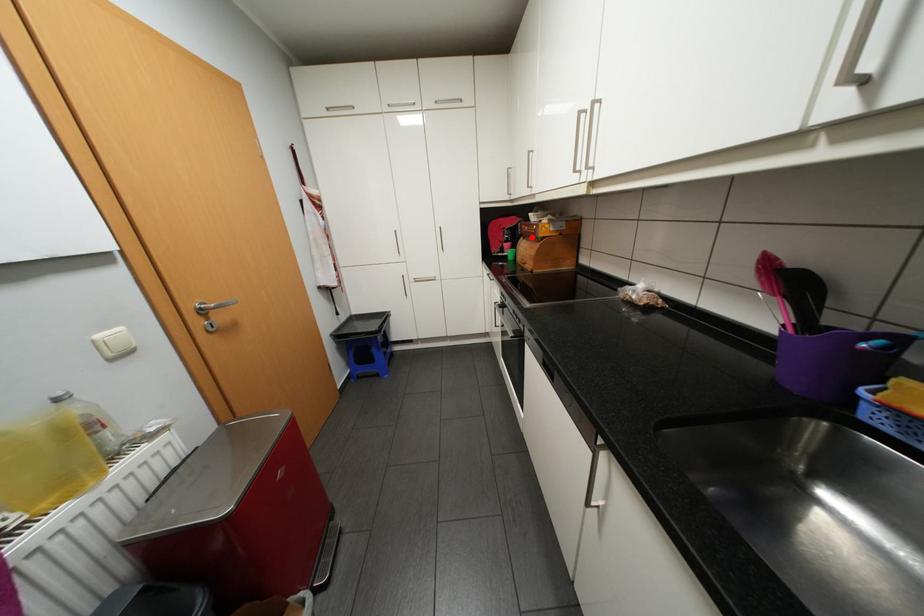
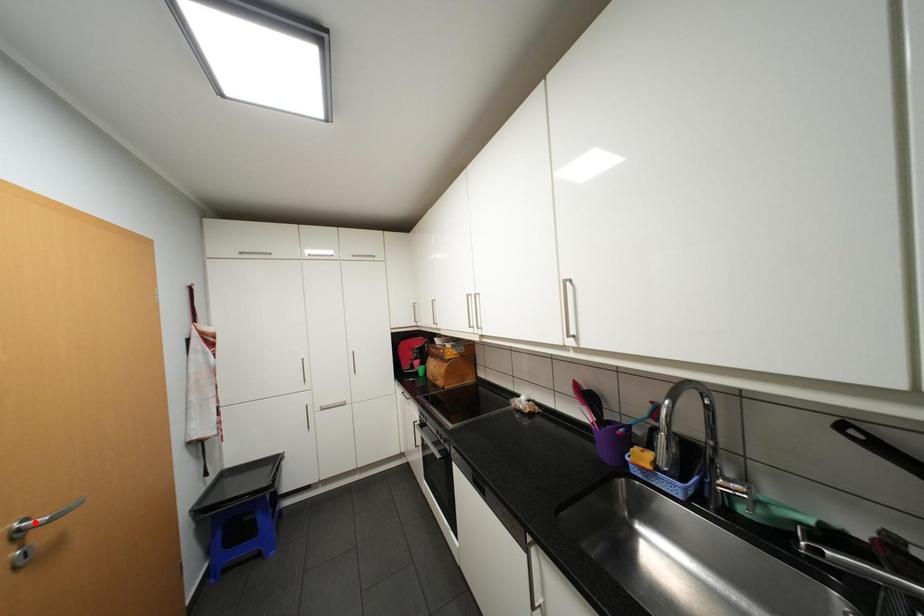
I am providing you with two images of the same scene from different viewpoints. A red point is marked on the first image and another point is marked on the second image. Do the highlighted points in image1 and image2 indicate the same real-world spot?

No